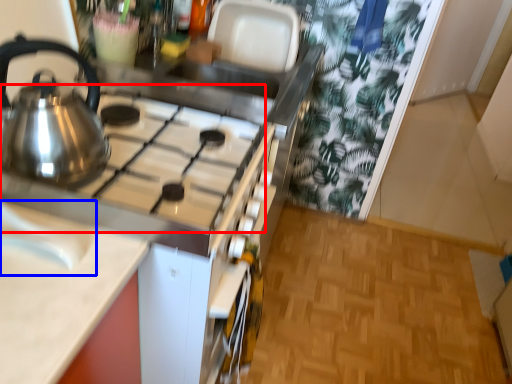
Question: Which object is further to the camera taking this photo, gas stove (highlighted by a red box) or sink (highlighted by a blue box)?

Choices:
 (A) gas stove
 (B) sink

Answer: (A)